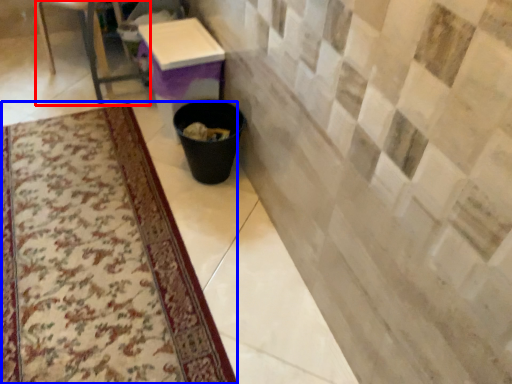
Question: Which object is further to the camera taking this photo, furniture (highlighted by a red box) or mat (highlighted by a blue box)?

Choices:
 (A) furniture
 (B) mat

Answer: (A)